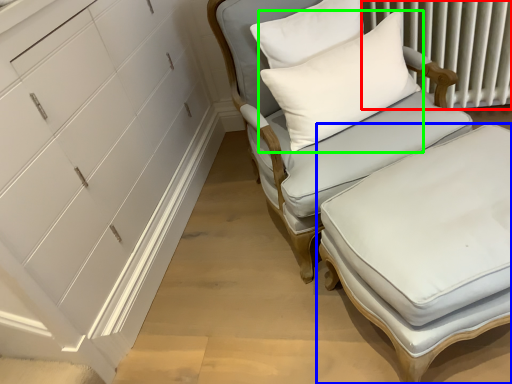
Question: Which object is positioned farthest from radiator (highlighted by a red box)? Select from table (highlighted by a blue box) and pillow (highlighted by a green box).

Choices:
 (A) table
 (B) pillow

Answer: (A)